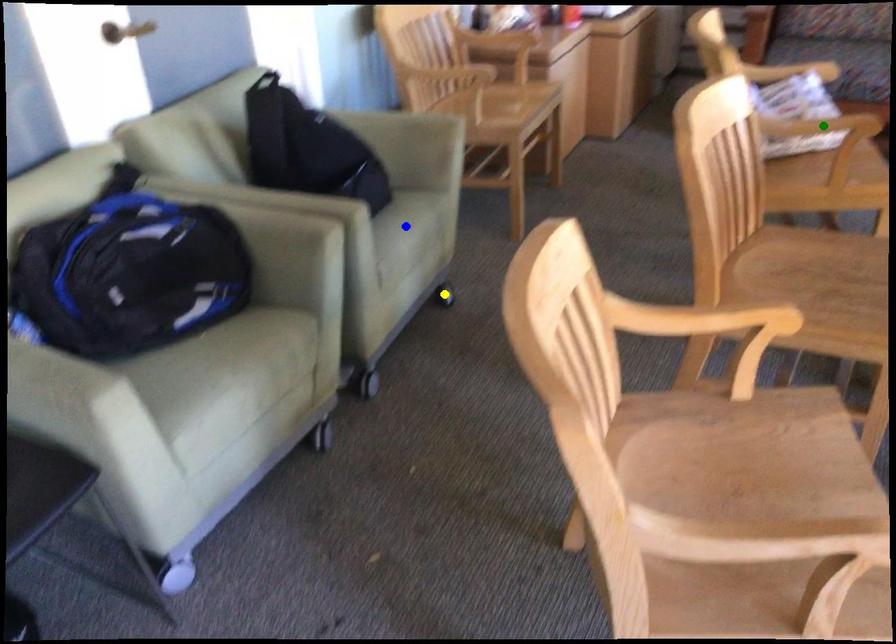
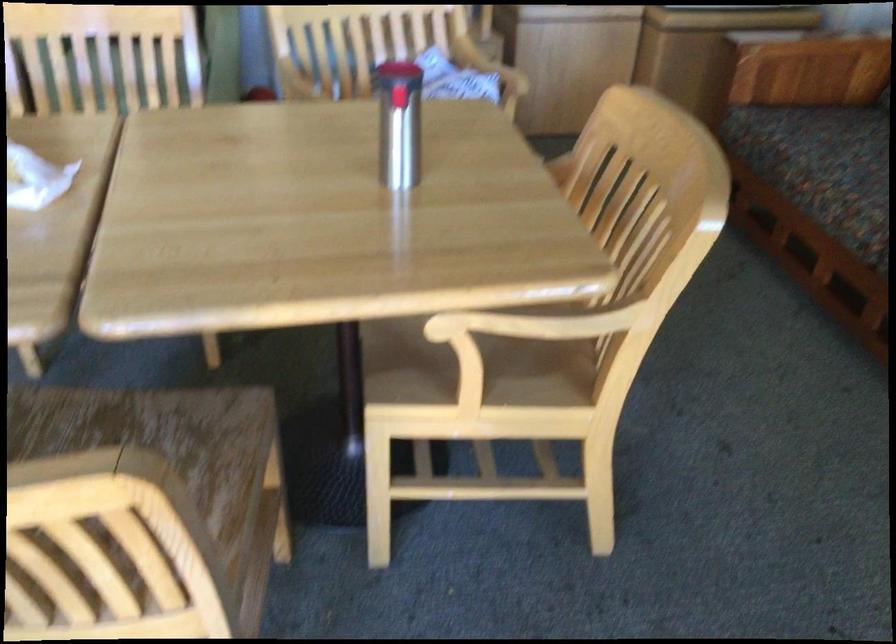
I am providing you with two images of the same scene from different viewpoints. Three points are marked in image1. Which point corresponds to a part or object that is occluded in image2?In image1, three points are marked. Which of them correspond to a part or object that is occluded in image2?Among the three points shown in image1, which one corresponds to a part or object that is no longer visible due to occlusion in image2?

green point, yellow point, blue point